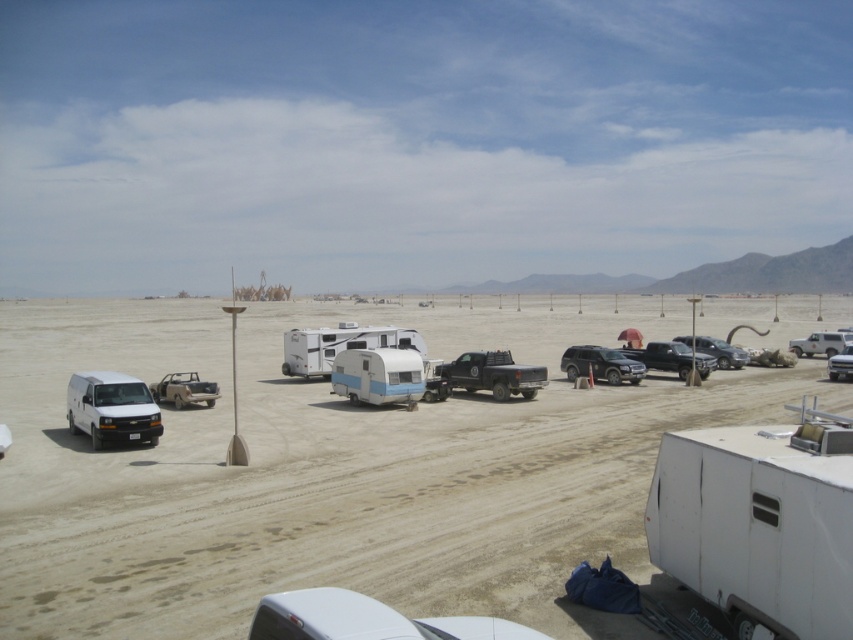
Looking at this image, you are planning to park your vehicle in this desert parking area. You have a vehicle that is 2 meters tall. The light blue plastic camper at center and the matte black truck at center are already parked. Can your vehicle fit under the clearance required between these two vehicles?

The light blue plastic camper at center is not as tall as matte black truck at center. Since your vehicle is 2 meters tall, you need to ensure there is enough vertical clearance. However, without knowing the exact height of either vehicle, it is impossible to determine if your vehicle can fit under the clearance between them.

You are planning to drive a vehicle that has a height restriction of 3 meters. You see the white plastic camper at center and the white matte truck at right in the parking area. Which vehicle can you safely drive under a bridge with a 3 meter height limit without hitting the structure?

The white matte truck at right can be safely driven under the bridge because it is shorter than the white plastic camper at center, which is taller than the 3 meter limit.

You are a delivery driver who needs to park your 12.5 feet long truck between the light blue plastic camper at center and the matte black truck at center. Is there enough space between them to park your truck?

The distance between the light blue plastic camper at center and the matte black truck at center is 15.21 feet, which is wider than your 12.5 feet long truck. Therefore, there is enough space to park your truck between them.